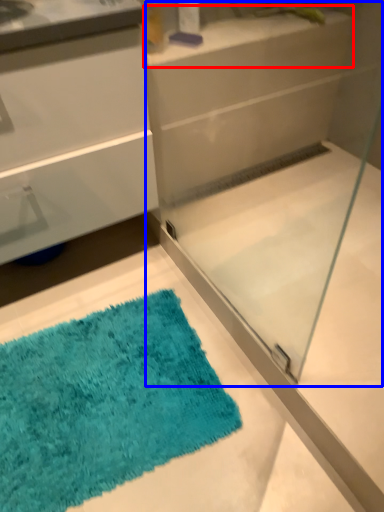
Question: Which point is further to the camera, counter top (highlighted by a red box) or glass box (highlighted by a blue box)?

Choices:
 (A) counter top
 (B) glass box

Answer: (A)